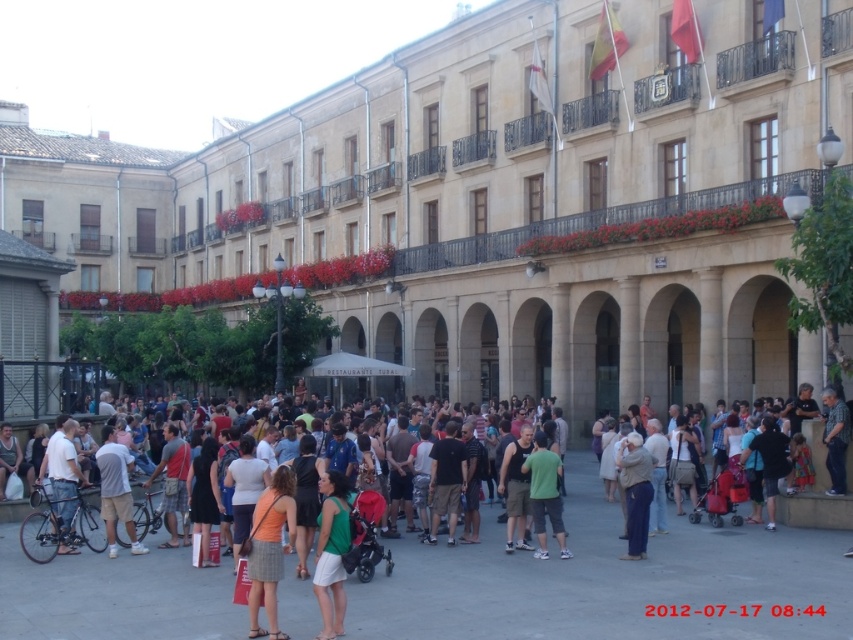
Who is more forward, (289, 612) or (318, 596)?

Positioned in front is point (318, 596).

Is point (715, 577) closer to camera compared to point (323, 524)?

No.

The width and height of the screenshot is (853, 640). In order to click on green cotton shirt at center in this screenshot , I will do `click(610, 580)`.

Does green matte dress at lower center have a smaller size compared to matte black bicycle at lower left?

Correct, green matte dress at lower center occupies less space than matte black bicycle at lower left.

Does green matte dress at lower center have a lesser height compared to matte black bicycle at lower left?

In fact, green matte dress at lower center may be taller than matte black bicycle at lower left.

Which is behind, point (338, 611) or point (74, 547)?

The point (74, 547) is more distant.

Where is `green matte dress at lower center`? This screenshot has width=853, height=640. green matte dress at lower center is located at coordinates (331, 554).

Is green matte dress at lower center positioned behind light beige fabric at center?

No, green matte dress at lower center is in front of light beige fabric at center.

Can you confirm if green matte dress at lower center is positioned below light beige fabric at center?

Yes.

Is point (335, 596) farther from camera compared to point (618, 456)?

No.

Find the location of `green matte dress at lower center`. green matte dress at lower center is located at coordinates (331, 554).